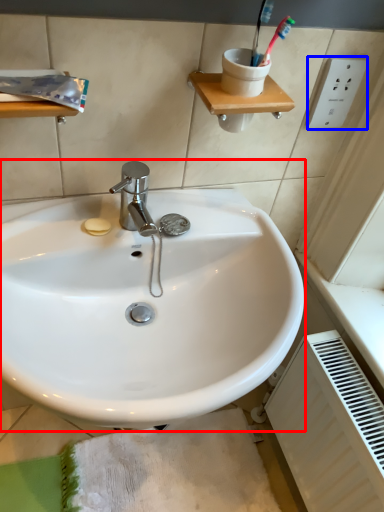
Question: Which object is further to the camera taking this photo, sink (highlighted by a red box) or electric outlet (highlighted by a blue box)?

Choices:
 (A) sink
 (B) electric outlet

Answer: (B)